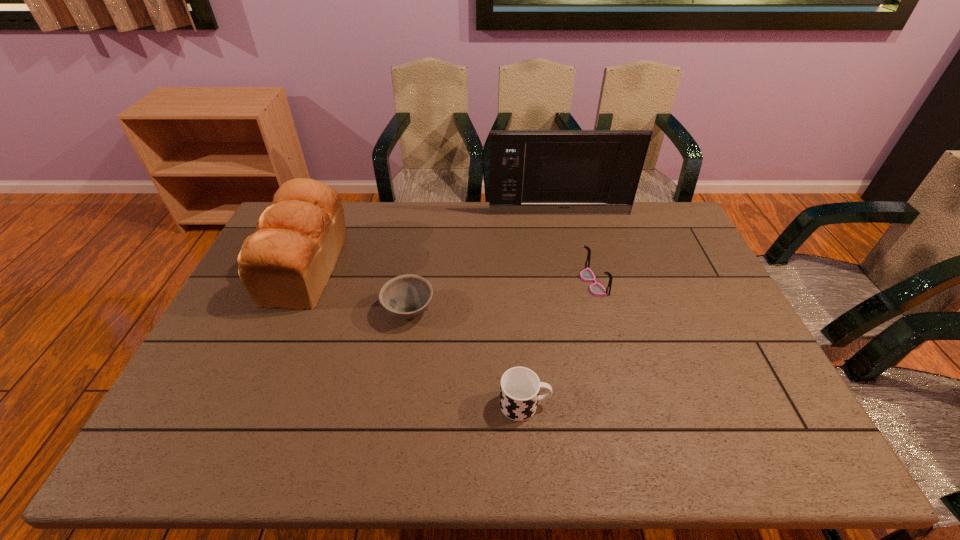
Image resolution: width=960 pixels, height=540 pixels. What are the coordinates of `vacant space located 0.060m on the back of the bread` in the screenshot? It's located at (326, 222).

Identify the location of blank space located on the back of the spectacles. The height and width of the screenshot is (540, 960). (577, 222).

At what (x,y) coordinates should I click in order to perform the action: click on vacant space located 0.180m on the side of the cup with the handle. Please return your answer as a coordinate pair (x, y). The width and height of the screenshot is (960, 540). Looking at the image, I should click on (624, 404).

You are a GUI agent. You are given a task and a screenshot of the screen. Output one action in this format:
    pyautogui.click(x=<x>, y=<y>)
    Task: Click on the free spot located 0.280m on the left of the fourth object from right to left
    
    Given the screenshot: What is the action you would take?
    pyautogui.click(x=287, y=311)

The image size is (960, 540). Identify the location of microwave oven located in the far edge section of the desktop. (540, 172).

Identify the location of bread that is at the far edge. The width and height of the screenshot is (960, 540). (287, 262).

Find the location of a particular element. object positioned at the left edge is located at coordinates (287, 262).

Identify the location of object located in the far left corner section of the desktop. point(287,262).

Locate an element on the screen. This screenshot has width=960, height=540. free space at the far edge of the desktop is located at coordinates (416, 236).

Identify the location of free space at the near edge of the desktop. Image resolution: width=960 pixels, height=540 pixels. (707, 451).